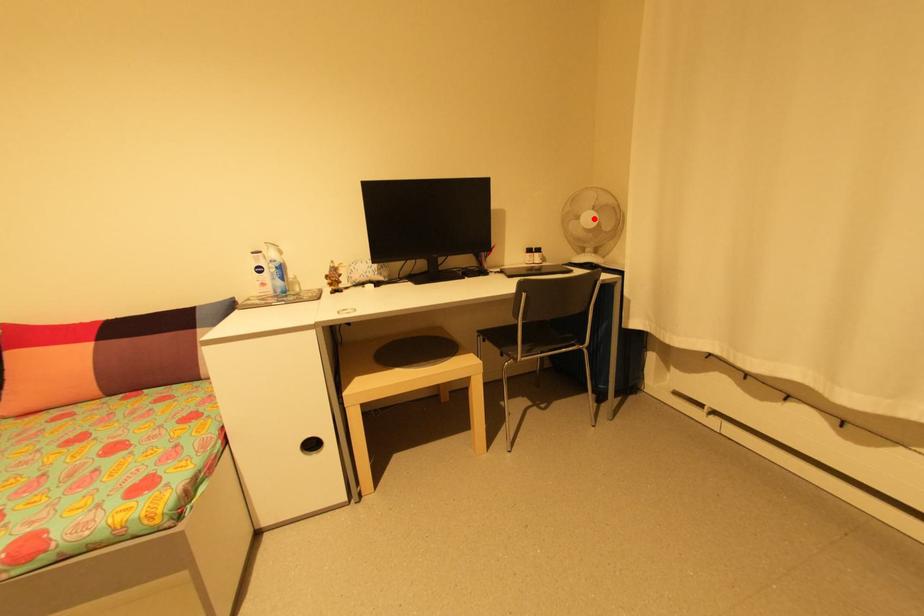
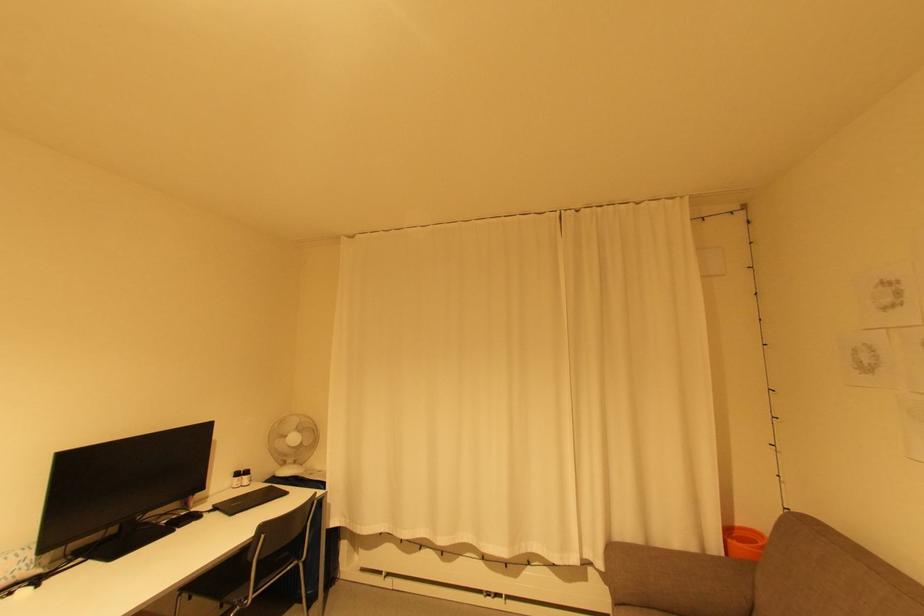
Question: I am providing you with two images of the same scene from different viewpoints. A red point is marked on the first image. Is the red point's position out of view in image 2?

Choices:
 (A) Yes
 (B) No

Answer: (B)